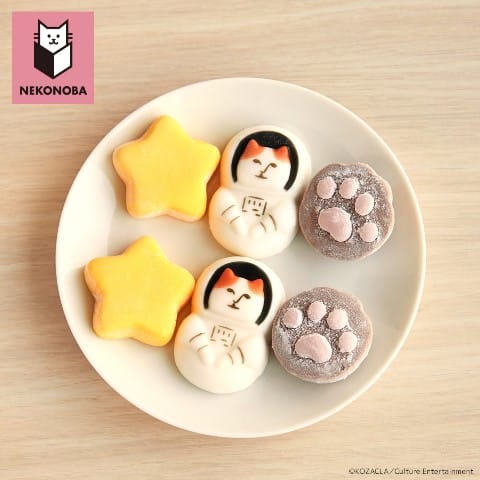
This screenshot has width=480, height=480. Identify the location of round white plate. (391, 283).